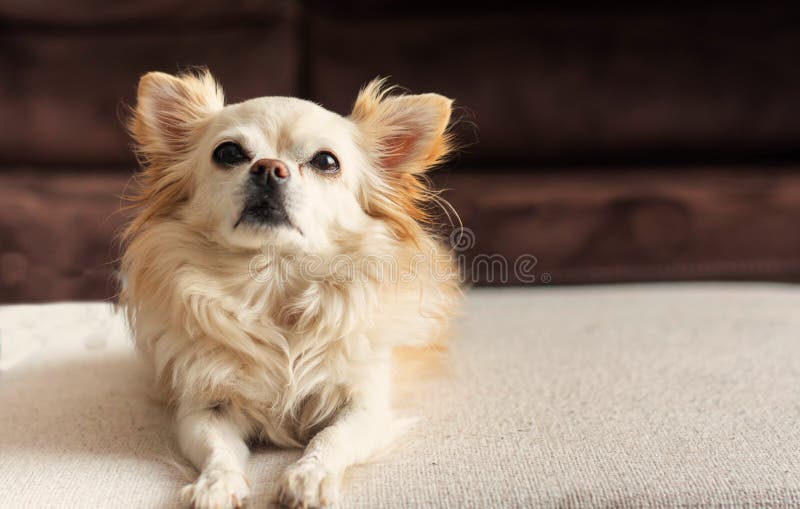
Identify the location of object you can sit on. (608, 337).